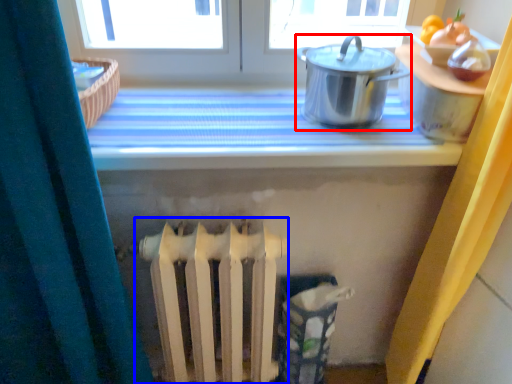
Question: Which object appears closest to the camera in this image, kitchen appliance (highlighted by a red box) or radiator (highlighted by a blue box)?

Choices:
 (A) kitchen appliance
 (B) radiator

Answer: (A)